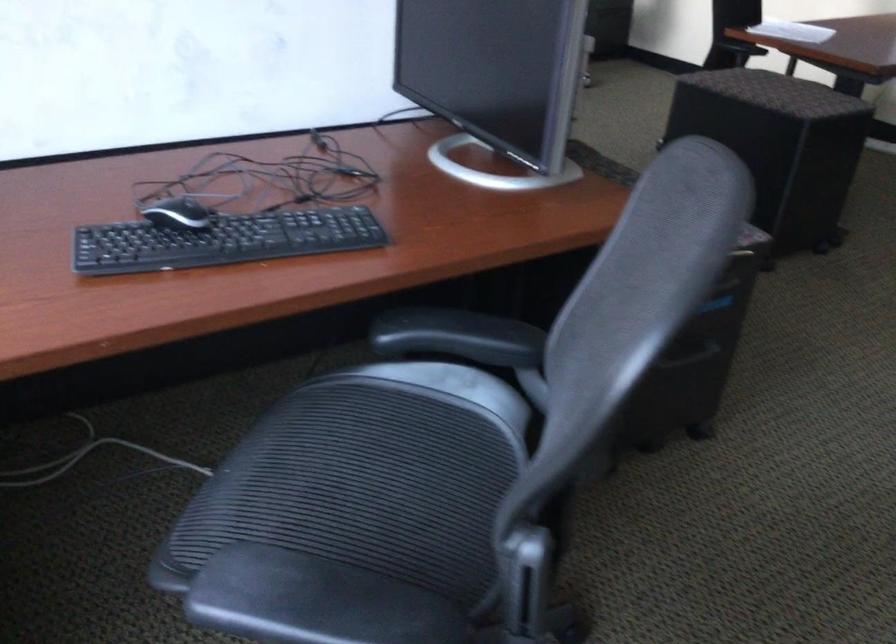
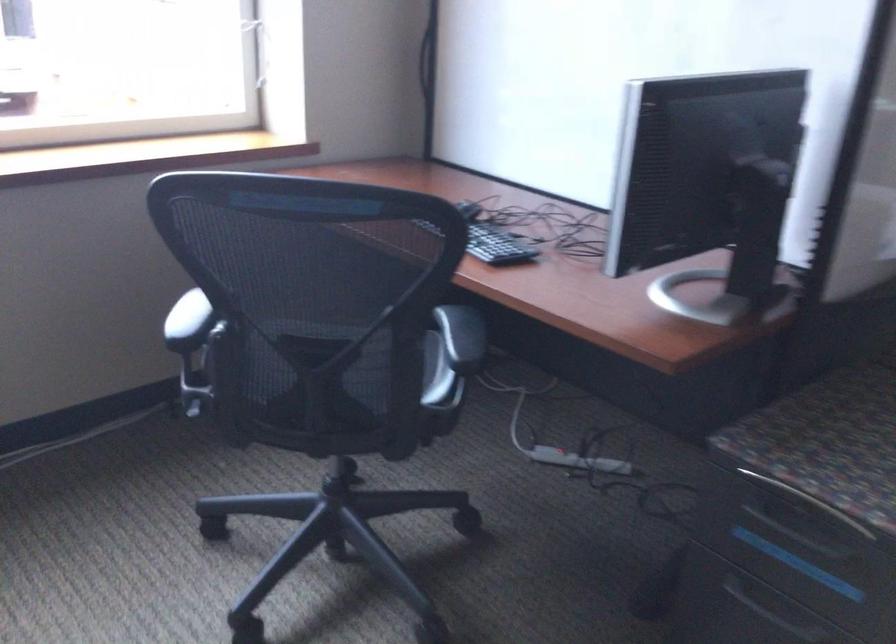
Question: I am providing you with two images of the same scene from different viewpoints. Which of the following objects are not visible in image2?

Choices:
 (A) red lever handle
 (B) recessed drawer handle
 (C) black keyboard
 (D) black chair armrest

Answer: (C)